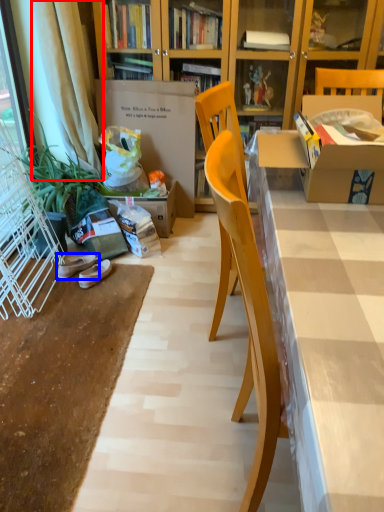
Question: Which object is further to the camera taking this photo, curtain (highlighted by a red box) or footwear (highlighted by a blue box)?

Choices:
 (A) curtain
 (B) footwear

Answer: (B)